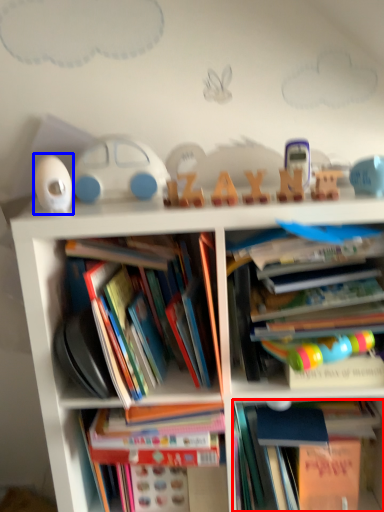
Question: Among these objects, which one is nearest to the camera, book (highlighted by a red box) or toy (highlighted by a blue box)?

Choices:
 (A) book
 (B) toy

Answer: (B)